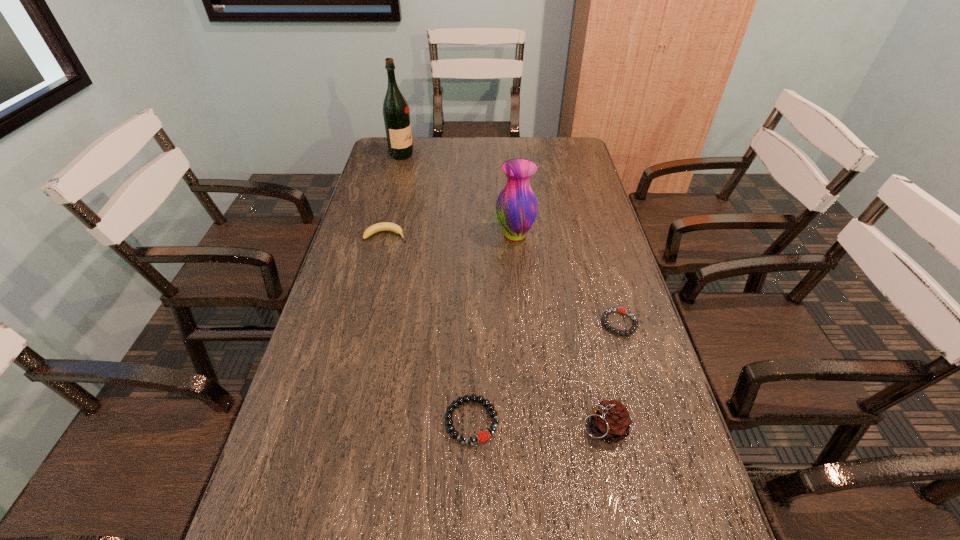
Select which object is the fifth closest to the left bracelet. Please provide its 2D coordinates. Your answer should be formatted as a tuple, i.e. [(x, y)], where the tuple contains the x and y coordinates of a point satisfying the conditions above.

[(396, 115)]

Select which object appears as the fifth closest to the fourth tallest object. Please provide its 2D coordinates. Your answer should be formatted as a tuple, i.e. [(x, y)], where the tuple contains the x and y coordinates of a point satisfying the conditions above.

[(610, 420)]

Identify the location of free location that satisfies the following two spatial constraints: 1. on the front-facing side of the tallest object; 2. on the right side of the fourth farthest object. (359, 322).

Where is `vacant region that satisfies the following two spatial constraints: 1. on the front-facing side of the second tallest object; 2. on the right side of the farthest object`? This screenshot has width=960, height=540. vacant region that satisfies the following two spatial constraints: 1. on the front-facing side of the second tallest object; 2. on the right side of the farthest object is located at coordinates (381, 235).

The width and height of the screenshot is (960, 540). What are the coordinates of `vacant area that satisfies the following two spatial constraints: 1. on the front-facing side of the farthest object; 2. on the right side of the nearer bracelet` in the screenshot? It's located at (333, 421).

Find the location of a particular element. The image size is (960, 540). blank space that satisfies the following two spatial constraints: 1. on the back side of the shorter bracelet; 2. on the front-facing side of the liquor is located at coordinates (570, 155).

The height and width of the screenshot is (540, 960). Identify the location of free space in the image that satisfies the following two spatial constraints: 1. at the stem of the third shortest object; 2. on the back side of the third nearest object. (365, 322).

This screenshot has width=960, height=540. In order to click on free space in the image that satisfies the following two spatial constraints: 1. on the back side of the fifth tallest object; 2. at the stem of the fourth tallest object in this screenshot , I will do `click(474, 235)`.

Locate an element on the screen. Image resolution: width=960 pixels, height=540 pixels. vacant space that satisfies the following two spatial constraints: 1. at the stem of the banana; 2. on the right side of the farther bracelet is located at coordinates (365, 322).

Find the location of a particular element. free location that satisfies the following two spatial constraints: 1. on the back side of the second shortest object; 2. at the stem of the fourth tallest object is located at coordinates (474, 235).